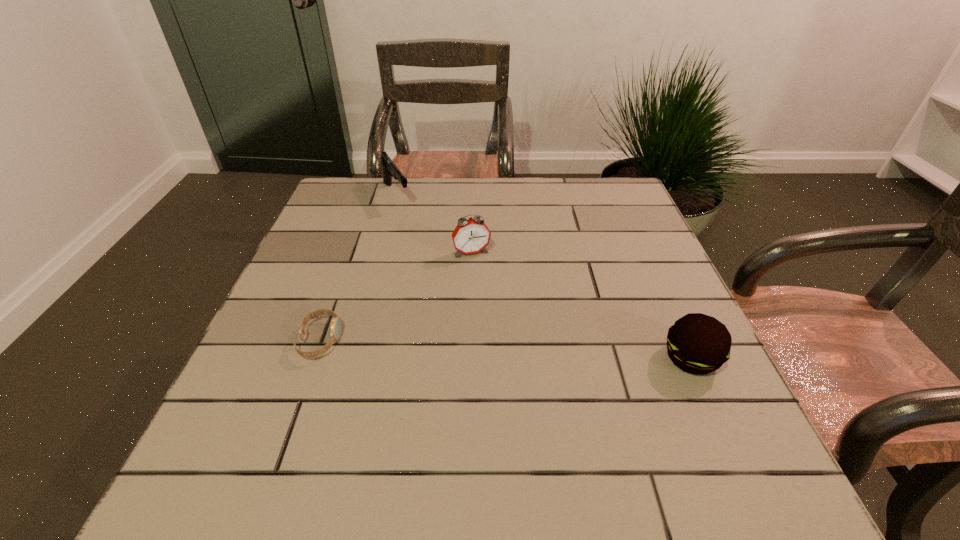
This screenshot has width=960, height=540. In order to click on watch in this screenshot , I will do `click(335, 334)`.

The width and height of the screenshot is (960, 540). I want to click on the rightmost object, so click(699, 344).

You are a GUI agent. You are given a task and a screenshot of the screen. Output one action in this format:
    pyautogui.click(x=<x>, y=<y>)
    Task: Click on the second shortest object
    The image size is (960, 540).
    Given the screenshot: What is the action you would take?
    pyautogui.click(x=699, y=344)

Find the location of a particular element. The height and width of the screenshot is (540, 960). the third object from left to right is located at coordinates (470, 236).

The width and height of the screenshot is (960, 540). I want to click on alarm clock, so click(x=470, y=236).

I want to click on gun, so click(390, 170).

Identify the location of free space located on the face of the watch. (385, 340).

You are a GUI agent. You are given a task and a screenshot of the screen. Output one action in this format:
    pyautogui.click(x=<x>, y=<y>)
    Task: Click on the vacant space located on the front of the rightmost object
    This screenshot has height=540, width=960.
    Given the screenshot: What is the action you would take?
    pyautogui.click(x=712, y=406)

At what (x,y) coordinates should I click in order to perform the action: click on vacant space located 0.350m on the clock face of the third object from left to right. Please return your answer as a coordinate pair (x, y). The height and width of the screenshot is (540, 960). Looking at the image, I should click on (518, 372).

I want to click on free location located 0.170m on the clock face of the third object from left to right, so click(493, 306).